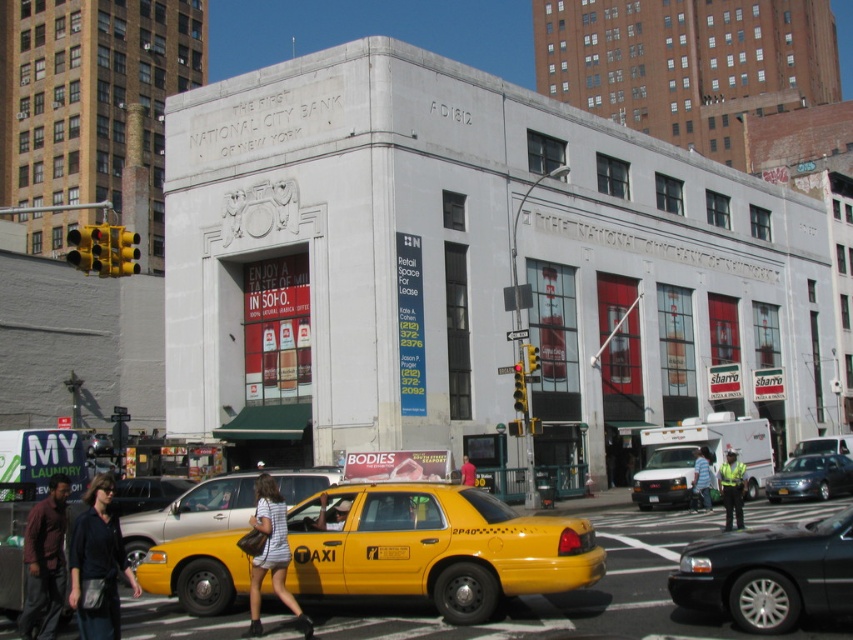
You are a pedestrian standing at the crosswalk. You see the yellow matte taxi at lower center and the striped fabric dress at center. Which object is closer to the left side of the crosswalk?

The striped fabric dress at center is closer to the left side of the crosswalk because the yellow matte taxi at lower center is positioned on the right side of striped fabric dress at center.

You are a pedestrian standing on the sidewalk and see the yellow matte taxi at lower center and the denim shorts at center. Which object is higher in the image?

The yellow matte taxi at lower center is above denim shorts at center, so it is higher in the image.

Based on the photo, you are a person standing on the sidewalk next to the yellow matte taxi at lower center and the denim shorts at center. Which object is taller?

The yellow matte taxi at lower center is taller than the denim shorts at center.